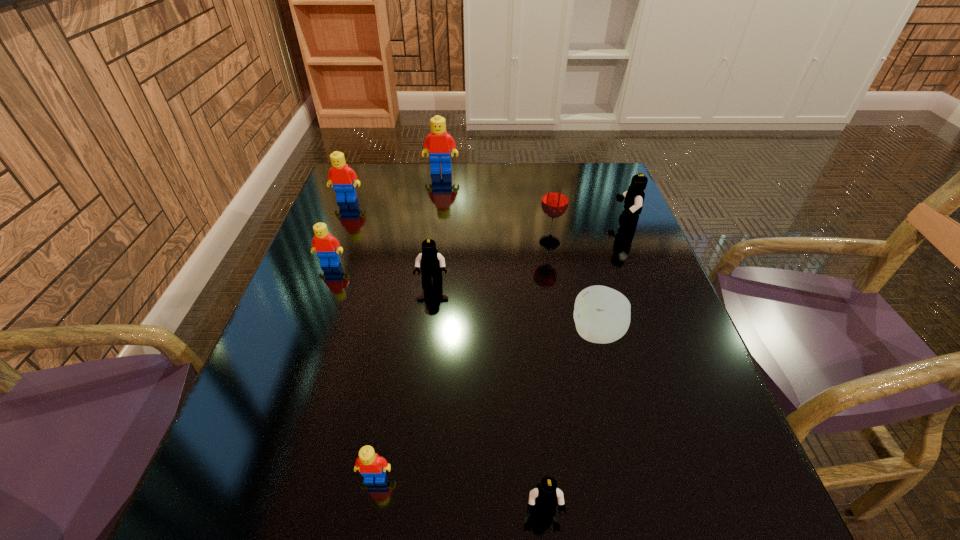
Locate an element on the screen. apple present at the right edge is located at coordinates (602, 315).

The width and height of the screenshot is (960, 540). What are the coordinates of `object that is positioned at the far left corner` in the screenshot? It's located at (343, 178).

In the image, there is a desktop. Identify the location of free space at the far edge. (469, 179).

In the image, there is a desktop. At what (x,y) coordinates should I click in order to perform the action: click on free space at the left edge. Please return your answer as a coordinate pair (x, y). The image size is (960, 540). Looking at the image, I should click on (x=288, y=389).

In the image, there is a desktop. Where is `vacant region at the right edge`? The height and width of the screenshot is (540, 960). vacant region at the right edge is located at coordinates (683, 411).

The image size is (960, 540). What are the coordinates of `vacant space at the near left corner of the desktop` in the screenshot? It's located at (231, 506).

The height and width of the screenshot is (540, 960). In order to click on vacant space at the far right corner of the desktop in this screenshot , I will do `click(588, 179)`.

In the image, there is a desktop. Identify the location of vacant area at the near right corner. (670, 504).

The image size is (960, 540). Find the location of `unoccupied position between the nearest red Lego and the farthest red Lego`. unoccupied position between the nearest red Lego and the farthest red Lego is located at coordinates (408, 325).

Find the location of `free spot between the glass and the sixth nearest Lego`. free spot between the glass and the sixth nearest Lego is located at coordinates (448, 221).